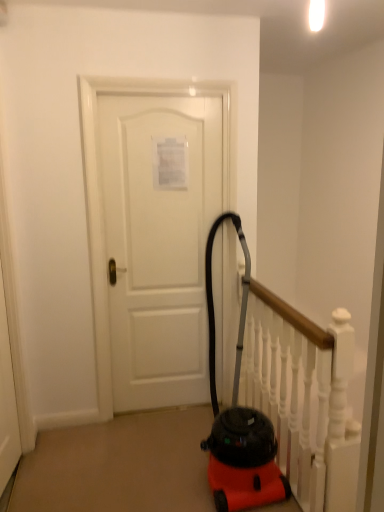
Image resolution: width=384 pixels, height=512 pixels. What are the coordinates of `free area below white matte door at center (from a real-world perspective)` in the screenshot? It's located at (147, 409).